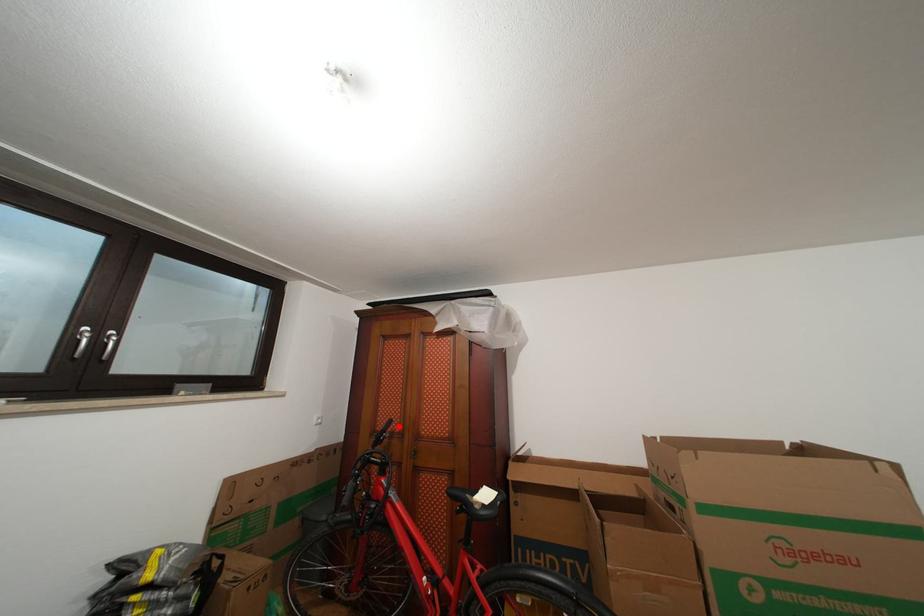
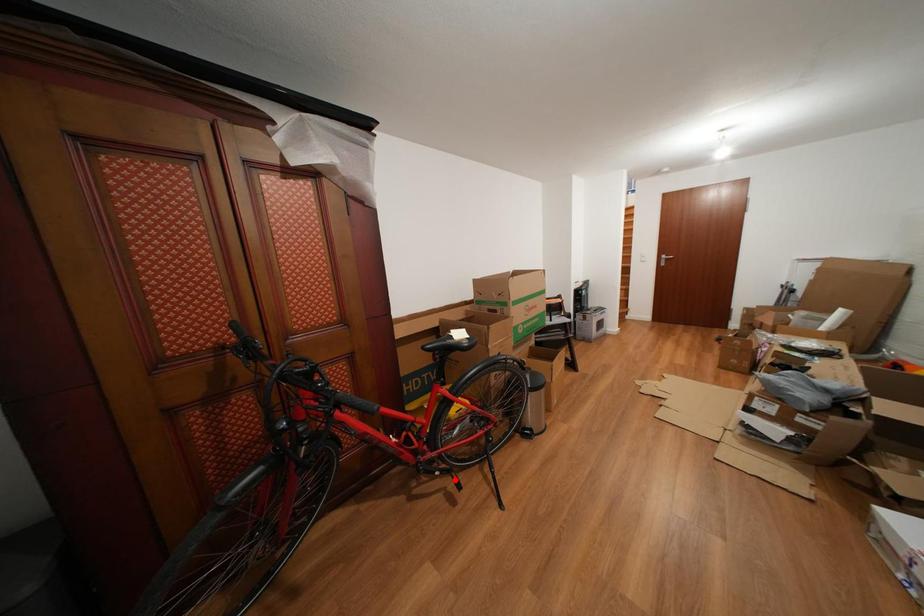
I am providing you with two images of the same scene from different viewpoints. A red point is marked on the first image and another point is marked on the second image. Does the point marked in image1 correspond to the same location as the one in image2?

No